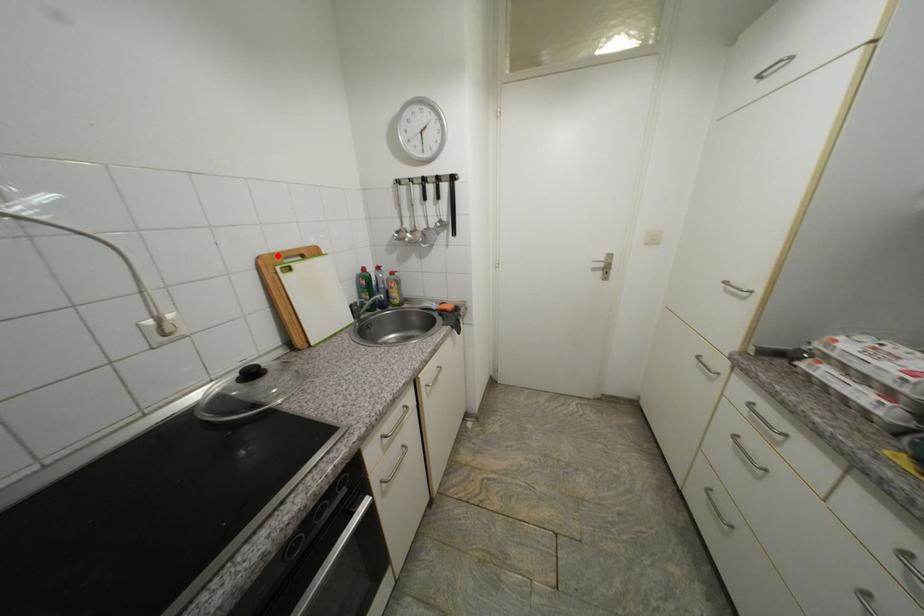
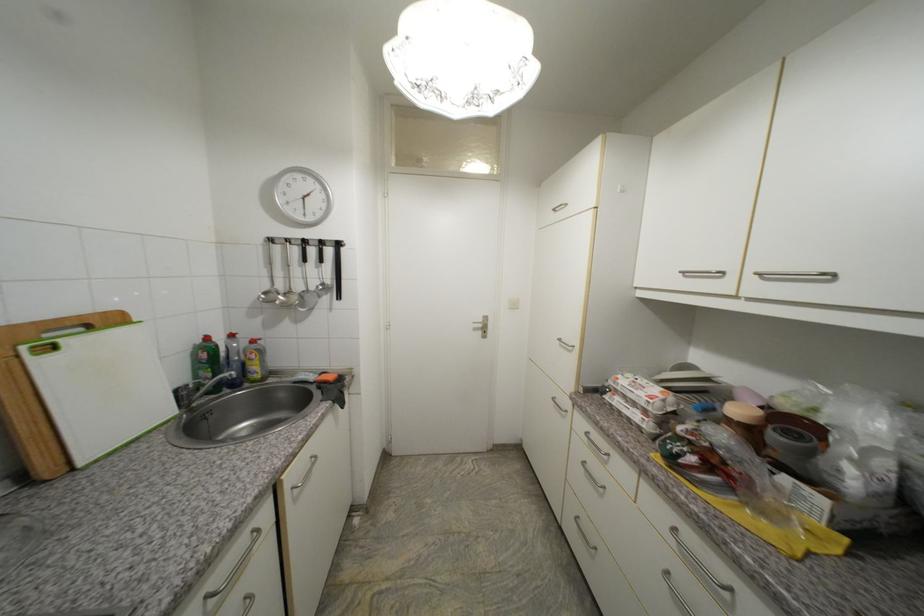
Locate, in the second image, the point that corresponds to the highlighted location in the first image.

(19, 328)